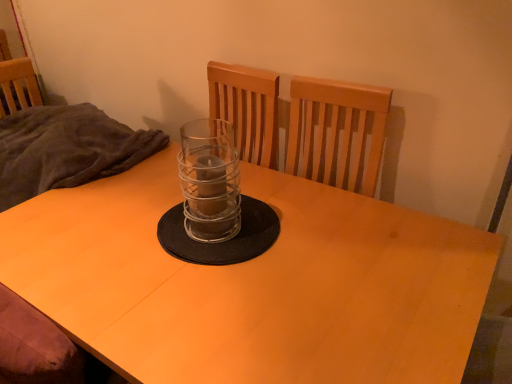
Question: Does clear glass candle holder at center have a smaller size compared to matte wood desk at center?

Choices:
 (A) no
 (B) yes

Answer: (B)

Question: Considering the relative sizes of clear glass candle holder at center and matte wood desk at center in the image provided, is clear glass candle holder at center thinner than matte wood desk at center?

Choices:
 (A) no
 (B) yes

Answer: (B)

Question: From the image's perspective, is clear glass candle holder at center located above matte wood desk at center?

Choices:
 (A) yes
 (B) no

Answer: (A)

Question: Does clear glass candle holder at center lie behind matte wood desk at center?

Choices:
 (A) no
 (B) yes

Answer: (B)

Question: Is clear glass candle holder at center turned away from matte wood desk at center?

Choices:
 (A) yes
 (B) no

Answer: (B)

Question: Considering the relative positions of dark gray fabric at left and matte wood desk at center in the image provided, is dark gray fabric at left to the left or to the right of matte wood desk at center?

Choices:
 (A) left
 (B) right

Answer: (A)

Question: Considering the positions of dark gray fabric at left and matte wood desk at center in the image, is dark gray fabric at left taller or shorter than matte wood desk at center?

Choices:
 (A) tall
 (B) short

Answer: (B)

Question: In terms of size, does dark gray fabric at left appear bigger or smaller than matte wood desk at center?

Choices:
 (A) small
 (B) big

Answer: (A)

Question: From the image's perspective, relative to matte wood desk at center, is dark gray fabric at left above or below?

Choices:
 (A) below
 (B) above

Answer: (B)

Question: From the image's perspective, relative to matte wood desk at center, is clear glass candle holder at center above or below?

Choices:
 (A) below
 (B) above

Answer: (B)

Question: Is point (234, 182) closer or farther from the camera than point (455, 294)?

Choices:
 (A) closer
 (B) farther

Answer: (B)

Question: Is clear glass candle holder at center in front of or behind matte wood desk at center in the image?

Choices:
 (A) front
 (B) behind

Answer: (B)

Question: From a real-world perspective, is clear glass candle holder at center physically located above or below matte wood desk at center?

Choices:
 (A) above
 (B) below

Answer: (A)

Question: Is point (86, 105) closer or farther from the camera than point (188, 259)?

Choices:
 (A) farther
 (B) closer

Answer: (A)

Question: In terms of size, does dark gray fabric at left appear bigger or smaller than clear glass candle holder at center?

Choices:
 (A) big
 (B) small

Answer: (A)